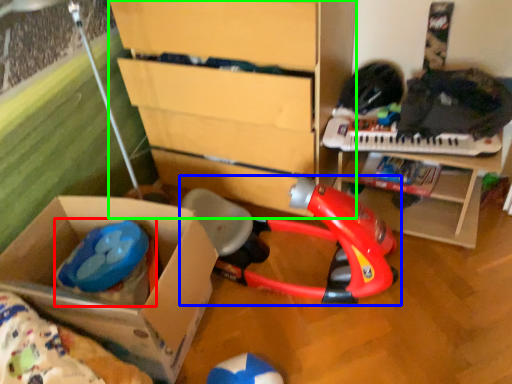
Question: Which object is the farthest from toy (highlighted by a red box)? Choose among these: toy (highlighted by a blue box) or chest of drawers (highlighted by a green box).

Choices:
 (A) toy
 (B) chest of drawers

Answer: (B)